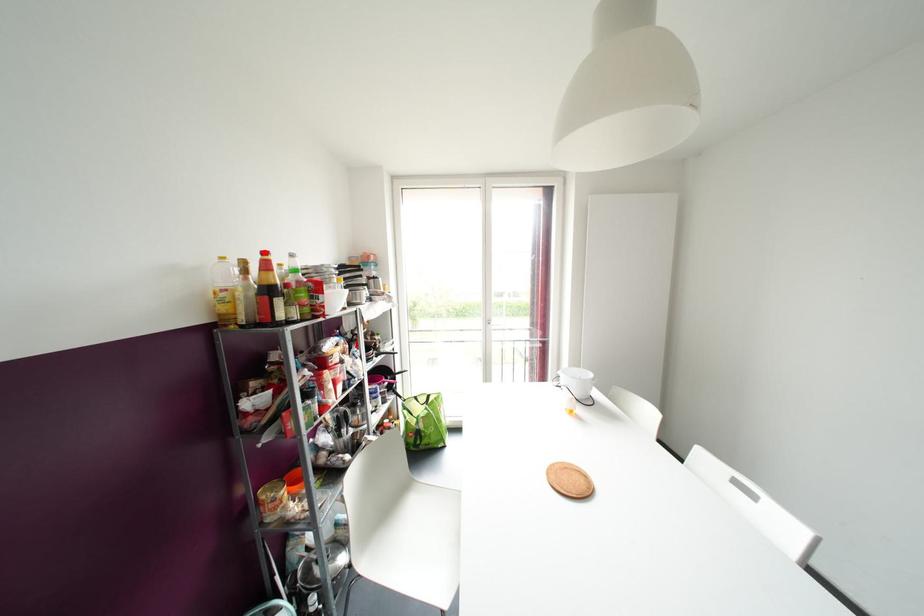
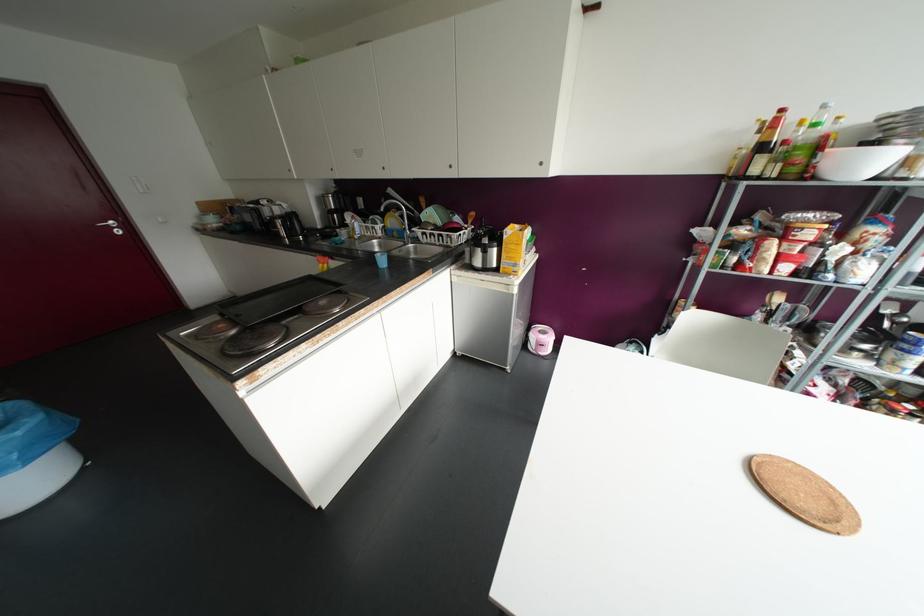
Where in the second image is the point corresponding to the highlighted location from the first image?

(781, 110)